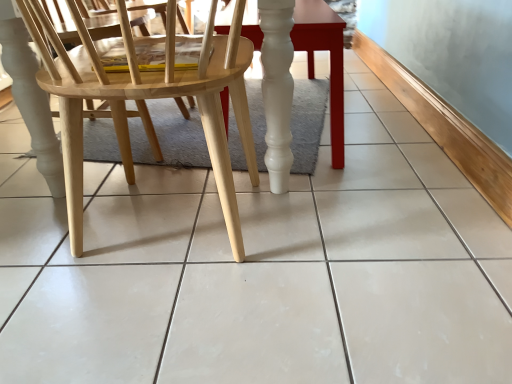
Question: Do you think natural wood chair at left is within smooth glossy wood table at center, or outside of it?

Choices:
 (A) inside
 (B) outside

Answer: (B)

Question: Is natural wood chair at left taller or shorter than smooth glossy wood table at center?

Choices:
 (A) short
 (B) tall

Answer: (B)

Question: Does point (75, 91) appear closer or farther from the camera than point (223, 24)?

Choices:
 (A) closer
 (B) farther

Answer: (A)

Question: Is smooth glossy wood table at center inside or outside of natural wood chair at left?

Choices:
 (A) outside
 (B) inside

Answer: (A)

Question: Considering the positions of point (308, 38) and point (153, 89), is point (308, 38) closer or farther from the camera than point (153, 89)?

Choices:
 (A) farther
 (B) closer

Answer: (A)

Question: Based on their positions, is smooth glossy wood table at center located to the left or right of natural wood chair at left?

Choices:
 (A) right
 (B) left

Answer: (A)

Question: Considering the positions of smooth glossy wood table at center and natural wood chair at left in the image, is smooth glossy wood table at center bigger or smaller than natural wood chair at left?

Choices:
 (A) small
 (B) big

Answer: (B)